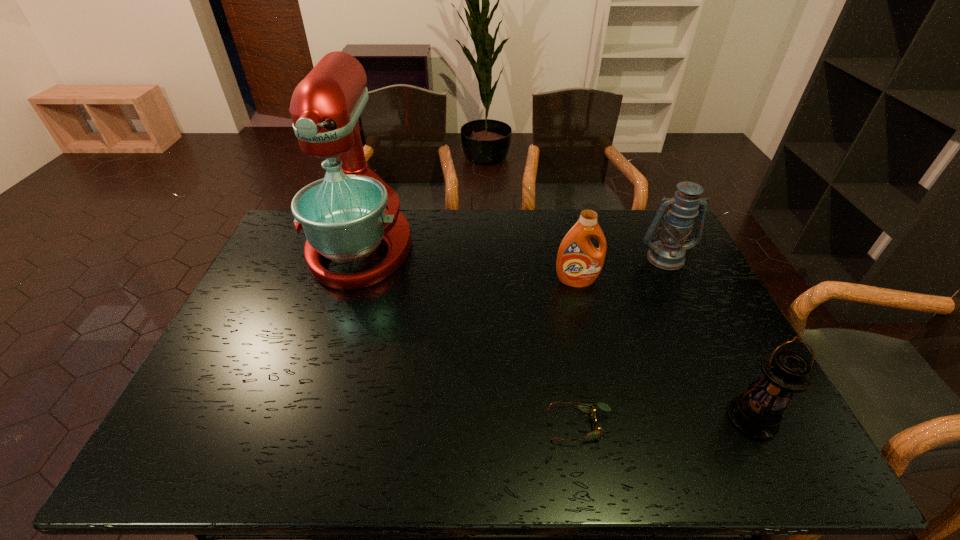
Where is `the tallest object`? Image resolution: width=960 pixels, height=540 pixels. the tallest object is located at coordinates (345, 216).

At what (x,y) coordinates should I click in order to perform the action: click on the leftmost object. Please return your answer as a coordinate pair (x, y). Looking at the image, I should click on pyautogui.click(x=345, y=216).

The height and width of the screenshot is (540, 960). I want to click on the farther lantern, so click(668, 253).

Find the location of a particular element. The image size is (960, 540). detergent is located at coordinates (579, 263).

Identify the location of the nearer lantern. (757, 413).

The width and height of the screenshot is (960, 540). What are the coordinates of `the shortest object` in the screenshot? It's located at (588, 408).

The height and width of the screenshot is (540, 960). What are the coordinates of `free spot located 0.110m on the front-facing side of the leftmost object` in the screenshot? It's located at (337, 319).

Image resolution: width=960 pixels, height=540 pixels. What are the coordinates of `free space located 0.180m on the front-facing side of the farther lantern` in the screenshot? It's located at (690, 309).

Locate an element on the screen. Image resolution: width=960 pixels, height=540 pixels. free location located on the front-facing side of the detergent is located at coordinates (593, 350).

Where is `vacant space situated on the front-facing side of the shortest object`? The width and height of the screenshot is (960, 540). vacant space situated on the front-facing side of the shortest object is located at coordinates (489, 426).